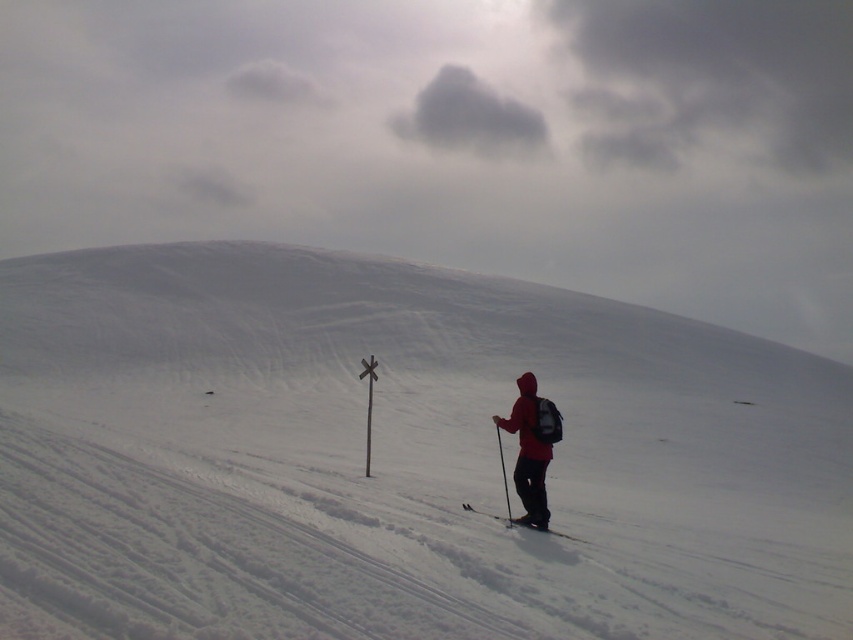
Question: Which of the following is the farthest from the observer?

Choices:
 (A) (508, 506)
 (B) (427, 140)
 (C) (668, 332)

Answer: (B)

Question: Does matte black ski at lower right have a lesser width compared to matte black ski pole at lower right?

Choices:
 (A) yes
 (B) no

Answer: (B)

Question: Which object appears closest to the camera in this image?

Choices:
 (A) matte black ski at lower right
 (B) white powdery snow at center
 (C) gray fluffy cloud at upper center
 (D) matte black ski pole at lower right

Answer: (B)

Question: Does white powdery snow at center have a greater width compared to matte black ski at lower right?

Choices:
 (A) yes
 (B) no

Answer: (A)

Question: Which of the following is the farthest from the observer?

Choices:
 (A) (573, 355)
 (B) (490, 515)
 (C) (497, 429)

Answer: (A)

Question: Is the position of matte red jacket at lower right more distant than that of matte black ski pole at lower right?

Choices:
 (A) yes
 (B) no

Answer: (B)